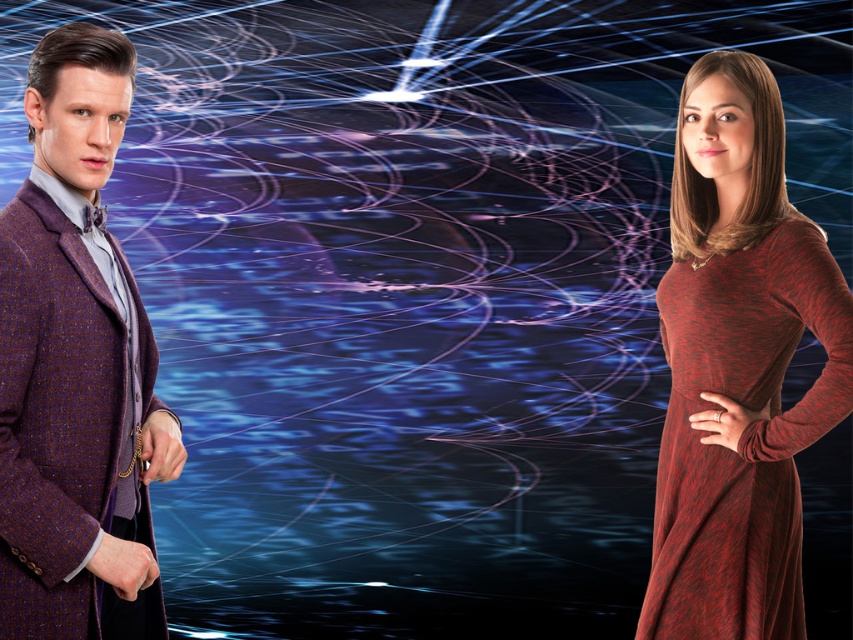
You are a fashion designer who needs to decide which garment to display in a narrow storefront window. Given the space constraints, which item between the plush wool coat at left and the maroon knit dress at right would you choose to fit better?

The plush wool coat at left has a lesser width compared to the maroon knit dress at right, so it would fit better in the narrow storefront window.

You are a fashion stylist trying to arrange outfits for a photoshoot. You have a plush wool coat at left and a maroon knit dress at right. Which outfit is positioned more to the left side of the frame?

The plush wool coat at left is positioned on the left side of the maroon knit dress at right, so the plush wool coat at left is more to the left.

You are a photographer setting up a shoot in this scene. You need to position a spotlight so that it illuminates the plush wool coat at left without affecting the maroon knit dress at right. Based on their positions, is this possible?

Yes, because the plush wool coat at left is in front of the maroon knit dress at right, you can angle the spotlight to shine directly on the coat while keeping the light from reaching the dress behind it.